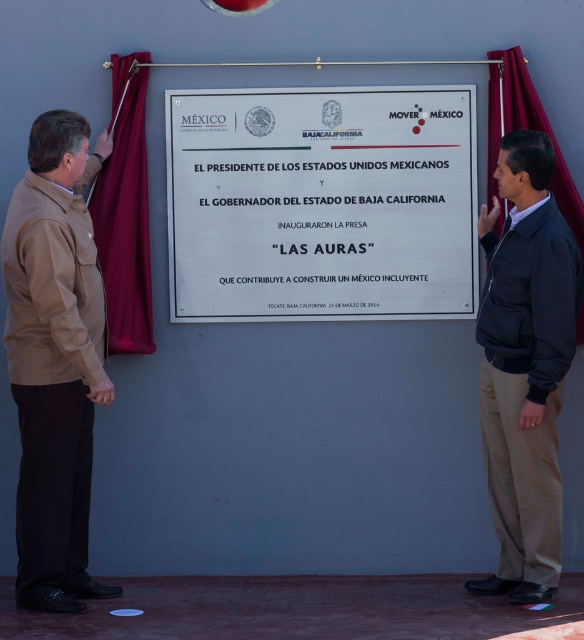
Consider the image. Can you confirm if white metallic plaque at center is positioned above dark blue jacket at right?

Yes, white metallic plaque at center is above dark blue jacket at right.

Who is higher up, white metallic plaque at center or dark blue jacket at right?

white metallic plaque at center is above.

From the picture: Who is more forward, (176, 141) or (566, 362)?

Point (566, 362) is in front.

At what (x,y) coordinates should I click in order to perform the action: click on white metallic plaque at center. Please return your answer as a coordinate pair (x, y). Image resolution: width=584 pixels, height=640 pixels. Looking at the image, I should click on (321, 202).

Measure the distance between white metallic plaque at center and tan fabric jacket at left.

They are 1.14 meters apart.

Which of these two, white metallic plaque at center or tan fabric jacket at left, stands shorter?

Standing shorter between the two is white metallic plaque at center.

Is point (440, 237) less distant than point (55, 566)?

No, (440, 237) is behind (55, 566).

Where is `white metallic plaque at center`? This screenshot has width=584, height=640. white metallic plaque at center is located at coordinates (321, 202).

Is tan fabric jacket at left further to camera compared to dark blue jacket at right?

No, tan fabric jacket at left is in front of dark blue jacket at right.

Does point (106, 381) come closer to viewer compared to point (515, 330)?

Yes, it is in front of point (515, 330).

Where is `tan fabric jacket at left`? tan fabric jacket at left is located at coordinates (54, 358).